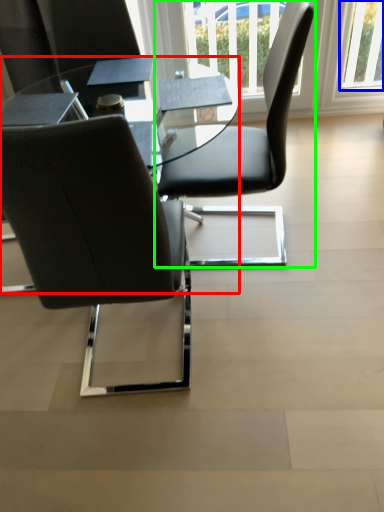
Question: Estimate the real-world distances between objects in this image. Which object is closer to table (highlighted by a red box), window (highlighted by a blue box) or chair (highlighted by a green box)?

Choices:
 (A) window
 (B) chair

Answer: (B)